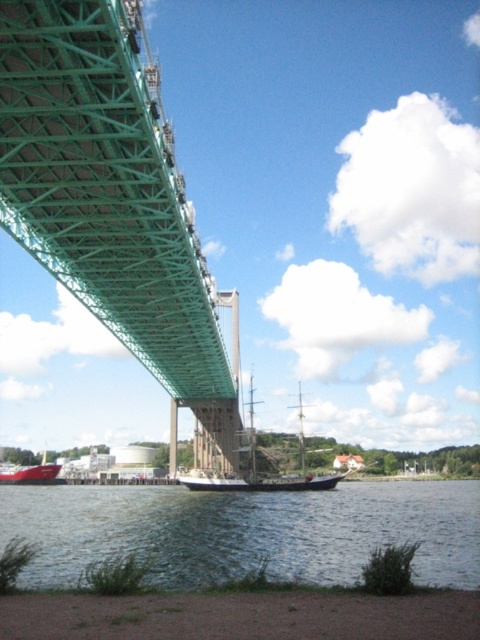
Question: Is green metallic suspension bridge at upper left bigger than smooth water at lower center?

Choices:
 (A) no
 (B) yes

Answer: (A)

Question: Among these points, which one is nearest to the camera?

Choices:
 (A) (315, 480)
 (B) (52, 481)
 (C) (372, 532)
 (D) (132, 240)

Answer: (D)

Question: Can you confirm if green metallic suspension bridge at upper left is positioned to the left of wooden sailboat at center?

Choices:
 (A) yes
 (B) no

Answer: (A)

Question: Which object appears farthest from the camera in this image?

Choices:
 (A) matte red boat at lower left
 (B) smooth water at lower center
 (C) wooden sailboat at center
 (D) green metallic suspension bridge at upper left

Answer: (A)

Question: Which point appears farthest from the camera in this image?

Choices:
 (A) (188, 561)
 (B) (43, 467)

Answer: (B)

Question: Is smooth water at lower center bigger than matte red boat at lower left?

Choices:
 (A) no
 (B) yes

Answer: (B)